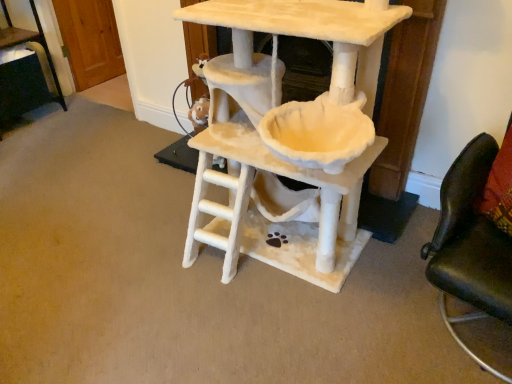
Image resolution: width=512 pixels, height=384 pixels. Describe the element at coordinates (282, 142) in the screenshot. I see `beige fluffy cat tree at center` at that location.

Where is `beige fluffy cat tree at center`? beige fluffy cat tree at center is located at coordinates (282, 142).

Find the location of a particular element. beige fluffy cat tree at center is located at coordinates (282, 142).